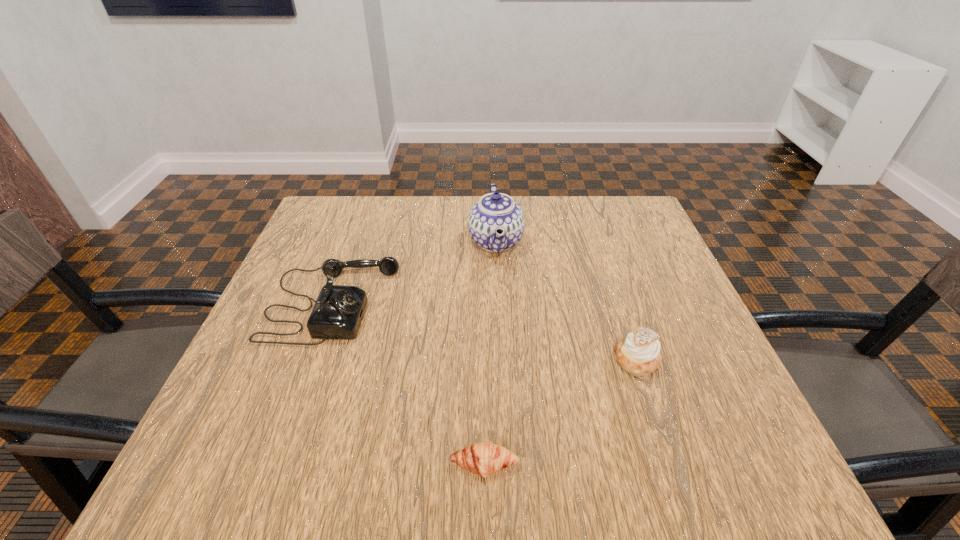
At what (x,y) coordinates should I click in order to perform the action: click on vacant space that is in between the rightmost object and the telephone. Please return your answer as a coordinate pair (x, y). Looking at the image, I should click on (484, 332).

The image size is (960, 540). What are the coordinates of `free space between the right pastry and the tallest object` in the screenshot? It's located at (566, 300).

At what (x,y) coordinates should I click in order to perform the action: click on unoccupied position between the shortest object and the chinaware. Please return your answer as a coordinate pair (x, y). Looking at the image, I should click on (490, 353).

Where is `object identified as the closest to the taller pastry`? The image size is (960, 540). object identified as the closest to the taller pastry is located at coordinates (482, 458).

Identify the location of object that is the closest to the chinaware. Image resolution: width=960 pixels, height=540 pixels. (338, 311).

Where is `blank space that satisfies the following two spatial constraints: 1. at the spout of the tallest object; 2. on the front-facing side of the shorter pastry`? blank space that satisfies the following two spatial constraints: 1. at the spout of the tallest object; 2. on the front-facing side of the shorter pastry is located at coordinates (506, 464).

Find the location of `free space that satisfies the following two spatial constraints: 1. on the back side of the right pastry; 2. on the dial of the third shortest object`. free space that satisfies the following two spatial constraints: 1. on the back side of the right pastry; 2. on the dial of the third shortest object is located at coordinates (618, 303).

Locate an element on the screen. This screenshot has width=960, height=540. free region that satisfies the following two spatial constraints: 1. on the dial of the third tallest object; 2. on the right side of the leftmost object is located at coordinates (312, 359).

Find the location of `free space that satisfies the following two spatial constraints: 1. on the back side of the rightmost object; 2. on the dial of the leftmost object`. free space that satisfies the following two spatial constraints: 1. on the back side of the rightmost object; 2. on the dial of the leftmost object is located at coordinates (x=618, y=303).

I want to click on free point that satisfies the following two spatial constraints: 1. on the dial of the telephone; 2. on the left side of the second shortest object, so click(x=312, y=359).